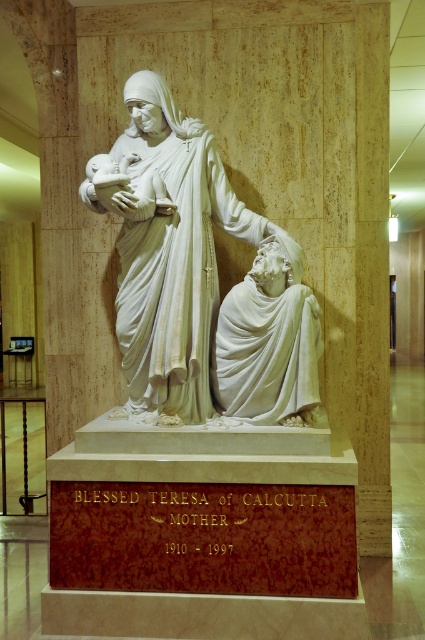
You are an art student standing in the museum and want to observe both the white marble statue at center and the white marble statue at lower right. Which statue should you approach first to get a closer look at the details of the one that is closer to you?

You should approach the white marble statue at center first because it is closer to you than the white marble statue at lower right, so you can examine its details more easily before moving to the one further away.

You are an art student standing in the museum and want to take a photo of both the white marble statue at center and the white marble statue at lower right. Which statue should you position yourself to the left of to capture both in one frame?

To capture both the white marble statue at center and the white marble statue at lower right in one frame, you should position yourself to the left of the white marble statue at lower right. This is because the white marble statue at center is to the left of the white marble statue at lower right, so positioning yourself to the left of the latter will allow you to include both statues in your photo.